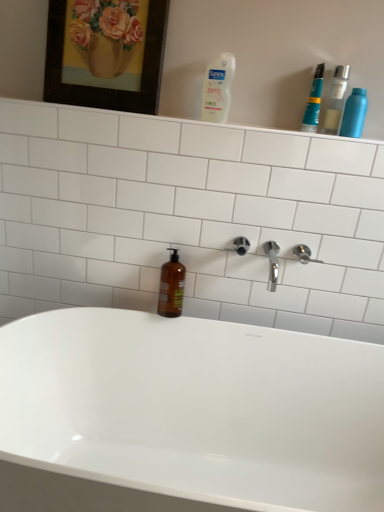
Where is `empty space that is in between wooden frame at upper left and white plastic bottle at upper center, which is the 1th cleaning product from left to right`? This screenshot has width=384, height=512. empty space that is in between wooden frame at upper left and white plastic bottle at upper center, which is the 1th cleaning product from left to right is located at coordinates (168, 115).